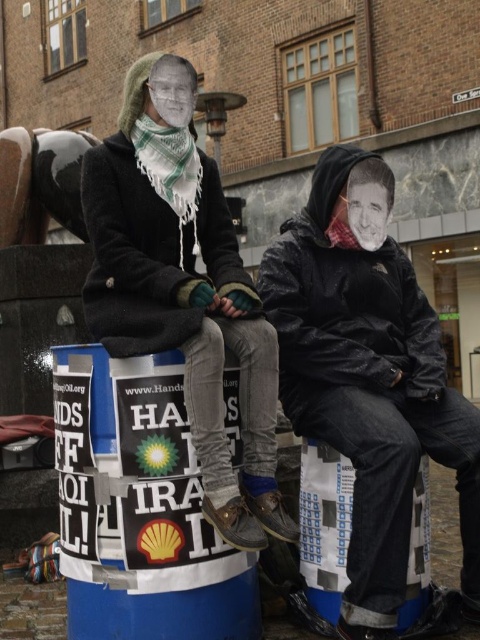
You are a photographer trying to capture a protest scene. You notice the wet black jacket at center and the matte black coat at upper left. Which clothing item is located to the right of the other?

The wet black jacket at center is positioned on the right side of matte black coat at upper left.

Based on the scene description, where is the wet black jacket at center located in terms of coordinates?

The wet black jacket at center is located at coordinates point (369,378).

You are a protester trying to decide which coat to wear for the demonstration. The weather forecast says it might rain. You have a wet black jacket at center and a matte black coat at upper left. Which coat would be better at keeping you dry?

The matte black coat at upper left is thicker than the wet black jacket at center, so it would provide better protection against the rain.